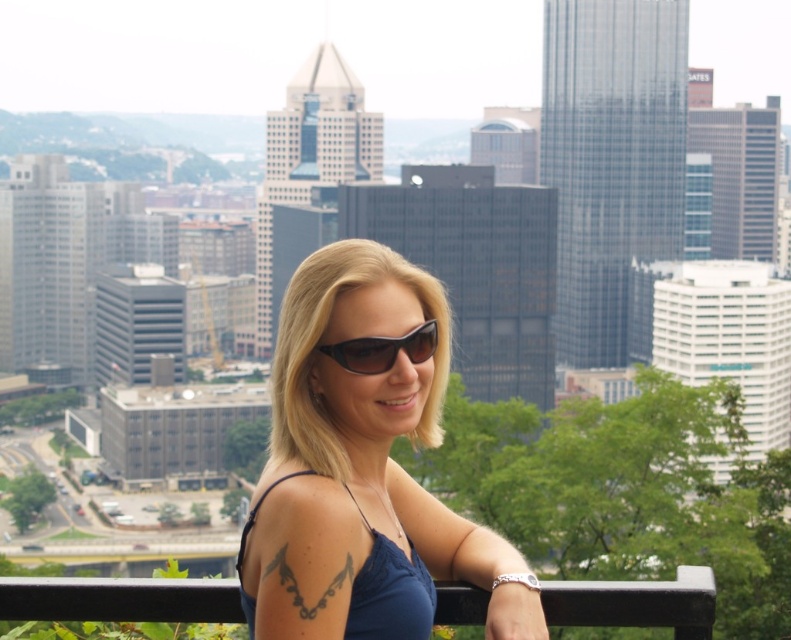
You are a fashion photographer who needs to capture the model wearing both the matte blue tank top at center and the blue fabric dress at center. Which piece of clothing is positioned to the right side of the other?

The matte blue tank top at center is positioned on the right side of the blue fabric dress at center.

Consider the image. You are a photographer aiming to capture the cityscape behind the woman. To ensure the black metal balustrade at lower center doesn not block the view, where should you position your camera relative to the balustrade?

The black metal balustrade at lower center is located at coordinates point (118, 600). To avoid blocking the cityscape, position the camera to the side or behind the balustrade so it doesn not obstruct the view.

You are standing at the same position as the woman in the image and want to determine which of the two points, point (368, 429) or point (399, 595), is closer to you. Which one is closer?

Point (368, 429) is closer to you because it is further to the viewer than point (399, 595).